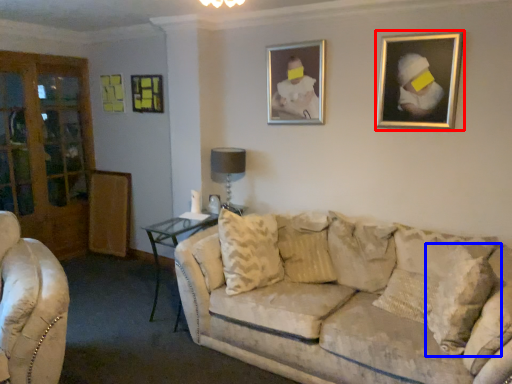
Question: Which object appears closest to the camera in this image, picture frame (highlighted by a red box) or pillow (highlighted by a blue box)?

Choices:
 (A) picture frame
 (B) pillow

Answer: (B)